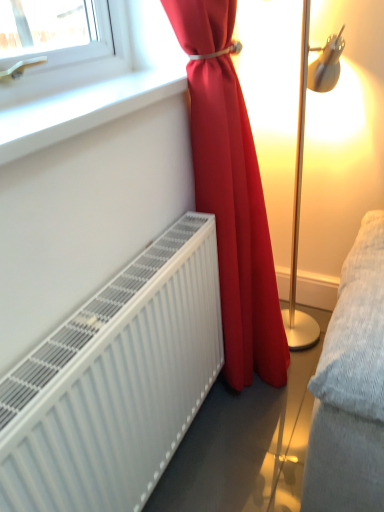
Find the location of a particular element. This screenshot has width=384, height=512. empty space that is ontop of white matte radiator at lower left (from a real-world perspective) is located at coordinates (62, 347).